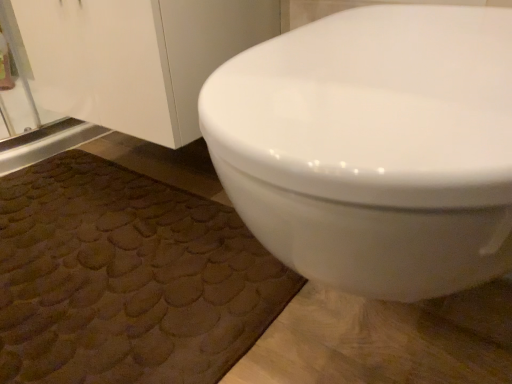
Where is `brown textured bath mat at lower left`? This screenshot has width=512, height=384. brown textured bath mat at lower left is located at coordinates [x=126, y=279].

What do you see at coordinates (126, 279) in the screenshot? I see `brown textured bath mat at lower left` at bounding box center [126, 279].

The image size is (512, 384). I want to click on white glossy toilet at upper right, so (x=374, y=147).

In order to face white glossy toilet at upper right, should I rotate leftwards or rightwards?

You should rotate right by 18.684 degrees.

The height and width of the screenshot is (384, 512). Describe the element at coordinates (374, 147) in the screenshot. I see `white glossy toilet at upper right` at that location.

Identify the location of brown textured bath mat at lower left. (126, 279).

Considering the relative positions of brown textured bath mat at lower left and white glossy toilet at upper right in the image provided, is brown textured bath mat at lower left to the left or to the right of white glossy toilet at upper right?

brown textured bath mat at lower left is to the left of white glossy toilet at upper right.

Is brown textured bath mat at lower left in front of or behind white glossy toilet at upper right in the image?

In the image, brown textured bath mat at lower left appears behind white glossy toilet at upper right.

Is point (39, 298) closer or farther from the camera than point (289, 46)?

Point (39, 298) is positioned farther from the camera compared to point (289, 46).

Looking at this image, from the image's perspective, is brown textured bath mat at lower left beneath white glossy toilet at upper right?

Yes, from the image's perspective, brown textured bath mat at lower left is beneath white glossy toilet at upper right.

From a real-world perspective, between brown textured bath mat at lower left and white glossy toilet at upper right, who is vertically lower?

brown textured bath mat at lower left, from a real-world perspective.

Considering the relative sizes of brown textured bath mat at lower left and white glossy toilet at upper right in the image provided, is brown textured bath mat at lower left wider than white glossy toilet at upper right?

Yes.

Considering the relative sizes of brown textured bath mat at lower left and white glossy toilet at upper right in the image provided, is brown textured bath mat at lower left shorter than white glossy toilet at upper right?

Yes, brown textured bath mat at lower left is shorter than white glossy toilet at upper right.

Between brown textured bath mat at lower left and white glossy toilet at upper right, which one has larger size?

white glossy toilet at upper right is bigger.

Is white glossy toilet at upper right inside brown textured bath mat at lower left?

Actually, white glossy toilet at upper right is outside brown textured bath mat at lower left.

Does brown textured bath mat at lower left touch white glossy toilet at upper right?

No, brown textured bath mat at lower left is not beside white glossy toilet at upper right.

Is brown textured bath mat at lower left facing away from white glossy toilet at upper right?

That's not correct — brown textured bath mat at lower left is not looking away from white glossy toilet at upper right.

Locate an element on the screen. Image resolution: width=512 pixels, height=384 pixels. bath mat lying below the white glossy toilet at upper right (from the image's perspective) is located at coordinates (126, 279).

Between white glossy toilet at upper right and brown textured bath mat at lower left, which one appears on the left side from the viewer's perspective?

From the viewer's perspective, brown textured bath mat at lower left appears more on the left side.

Based on the photo, between white glossy toilet at upper right and brown textured bath mat at lower left, which one is positioned in front?

white glossy toilet at upper right.

Which point is more distant from viewer, (396, 68) or (147, 265)?

The point (147, 265) is farther.

From the image's perspective, does white glossy toilet at upper right appear lower than brown textured bath mat at lower left?

No, from the image's perspective, white glossy toilet at upper right is not beneath brown textured bath mat at lower left.

From a real-world perspective, is white glossy toilet at upper right above or below brown textured bath mat at lower left?

In terms of real-world spatial position, white glossy toilet at upper right is above brown textured bath mat at lower left.

Considering the sizes of objects white glossy toilet at upper right and brown textured bath mat at lower left in the image provided, who is wider, white glossy toilet at upper right or brown textured bath mat at lower left?

brown textured bath mat at lower left.

Consider the image. Can you confirm if white glossy toilet at upper right is shorter than brown textured bath mat at lower left?

No.

Who is bigger, white glossy toilet at upper right or brown textured bath mat at lower left?

With larger size is white glossy toilet at upper right.

Is brown textured bath mat at lower left surrounded by white glossy toilet at upper right?

No, brown textured bath mat at lower left is not surrounded by white glossy toilet at upper right.

Is white glossy toilet at upper right directly adjacent to brown textured bath mat at lower left?

No, white glossy toilet at upper right is not beside brown textured bath mat at lower left.

Could you tell me if white glossy toilet at upper right is facing brown textured bath mat at lower left?

No, white glossy toilet at upper right is not aimed at brown textured bath mat at lower left.

How much distance is there between white glossy toilet at upper right and brown textured bath mat at lower left?

white glossy toilet at upper right and brown textured bath mat at lower left are 49.82 centimeters apart from each other.

Where is `toilet above the brown textured bath mat at lower left (from the image's perspective)`? This screenshot has height=384, width=512. toilet above the brown textured bath mat at lower left (from the image's perspective) is located at coordinates (374, 147).

I want to click on toilet in front of the brown textured bath mat at lower left, so click(x=374, y=147).

This screenshot has width=512, height=384. In order to click on bath mat to the left of white glossy toilet at upper right in this screenshot , I will do `click(126, 279)`.